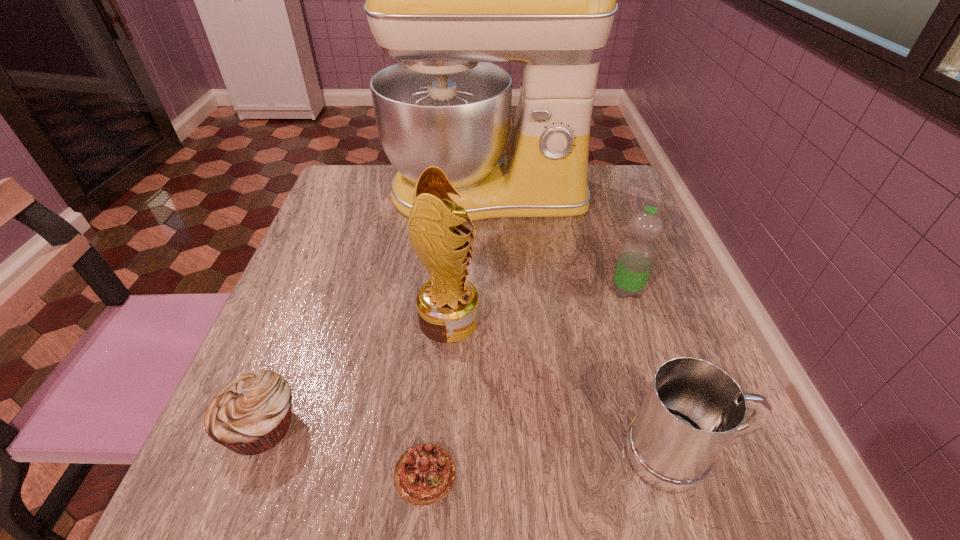
Where is `object identified as the fifth closest to the award`? The image size is (960, 540). object identified as the fifth closest to the award is located at coordinates [x=637, y=255].

Where is `object that is the fourth nearest to the shortest object`? object that is the fourth nearest to the shortest object is located at coordinates (637, 255).

The image size is (960, 540). In order to click on blank space that satisfies the following two spatial constraints: 1. on the side of the mixer with the control knob; 2. on the front-facing side of the fifth shortest object in this screenshot , I will do `click(491, 320)`.

At what (x,y) coordinates should I click in order to perform the action: click on vacant space that satisfies the following two spatial constraints: 1. on the front side of the fourth shortest object; 2. on the side of the fourth tallest object with the handle. Please return your answer as a coordinate pair (x, y). Looking at the image, I should click on (683, 454).

You are a GUI agent. You are given a task and a screenshot of the screen. Output one action in this format:
    pyautogui.click(x=<x>, y=<y>)
    Task: Click on the free spot that satisfies the following two spatial constraints: 1. on the side of the farthest object with the control knob; 2. on the front-facing side of the fifth shortest object
    
    Given the screenshot: What is the action you would take?
    (491, 320)

I want to click on vacant space that satisfies the following two spatial constraints: 1. on the front-facing side of the award; 2. on the front side of the muffin, so click(442, 426).

This screenshot has height=540, width=960. I want to click on vacant area in the image that satisfies the following two spatial constraints: 1. on the side of the fourth shortest object with the control knob; 2. on the left side of the tallest object, so click(490, 291).

You are a GUI agent. You are given a task and a screenshot of the screen. Output one action in this format:
    pyautogui.click(x=<x>, y=<y>)
    Task: Click on the vacant region that satisfies the following two spatial constraints: 1. on the front side of the third tallest object; 2. on the front-facing side of the fifth shortest object
    This screenshot has height=540, width=960.
    Given the screenshot: What is the action you would take?
    pyautogui.click(x=636, y=320)